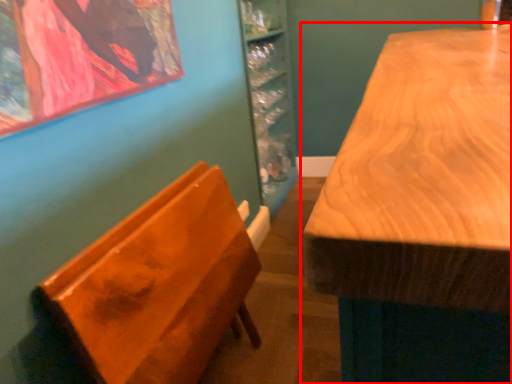
Question: Considering the relative positions of table (annotated by the red box) and furniture in the image provided, where is table (annotated by the red box) located with respect to the staircase?

Choices:
 (A) right
 (B) left

Answer: (A)